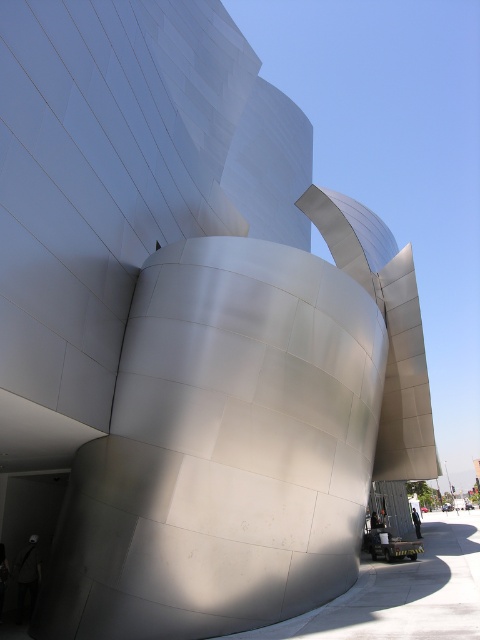
You are standing in front of the futuristic building and notice a dark gray fabric bag at lower left and dark blue jeans at lower right. Which object is positioned farther to the left side of the scene?

The dark gray fabric bag at lower left is positioned farther to the left side of the scene compared to the dark blue jeans at lower right.

In the scene shown: You are standing in front of the architectural structure and see the dark gray fabric bag at lower left and the dark blue jeans at lower right. Which object is positioned higher in the image?

The dark gray fabric bag at lower left is above dark blue jeans at lower right, so it is positioned higher in the image.

You are standing in front of the futuristic building and see a dark gray fabric bag at lower left and dark blue jeans at lower right. Which object is taller?

The dark gray fabric bag at lower left is not as tall as the dark blue jeans at lower right, so the dark blue jeans at lower right are taller.